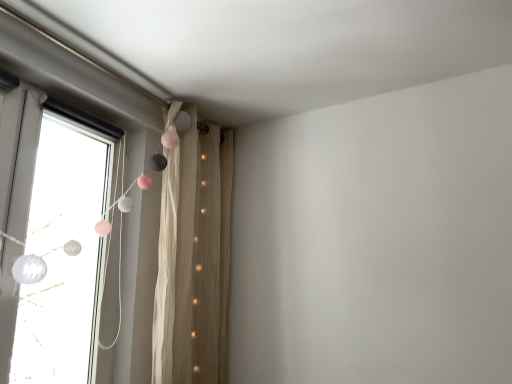
Question: From the image's perspective, is beige textured curtain at upper left located above or below white matte curtain at left?

Choices:
 (A) above
 (B) below

Answer: (B)

Question: Do you think beige textured curtain at upper left is within white matte curtain at left, or outside of it?

Choices:
 (A) inside
 (B) outside

Answer: (B)

Question: In the image, is beige textured curtain at upper left on the left side or the right side of white matte curtain at left?

Choices:
 (A) left
 (B) right

Answer: (B)

Question: Based on their sizes in the image, would you say white matte curtain at left is bigger or smaller than beige textured curtain at upper left?

Choices:
 (A) big
 (B) small

Answer: (A)

Question: Relative to beige textured curtain at upper left, is white matte curtain at left in front or behind?

Choices:
 (A) front
 (B) behind

Answer: (A)

Question: Which is correct: white matte curtain at left is inside beige textured curtain at upper left, or outside of it?

Choices:
 (A) outside
 (B) inside

Answer: (A)

Question: In terms of width, does white matte curtain at left look wider or thinner when compared to beige textured curtain at upper left?

Choices:
 (A) wide
 (B) thin

Answer: (B)